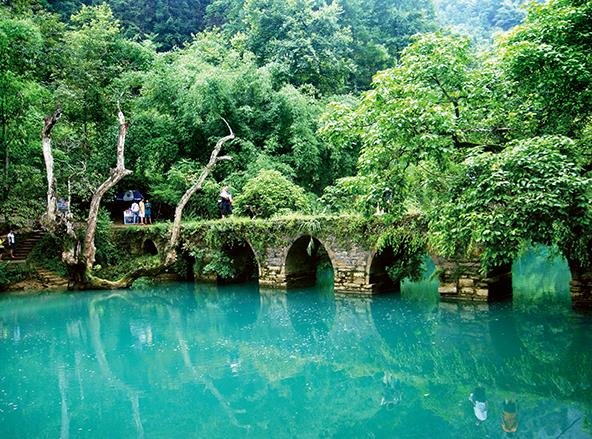
Locate an element on the screen. The image size is (592, 439). light is located at coordinates (83, 41).